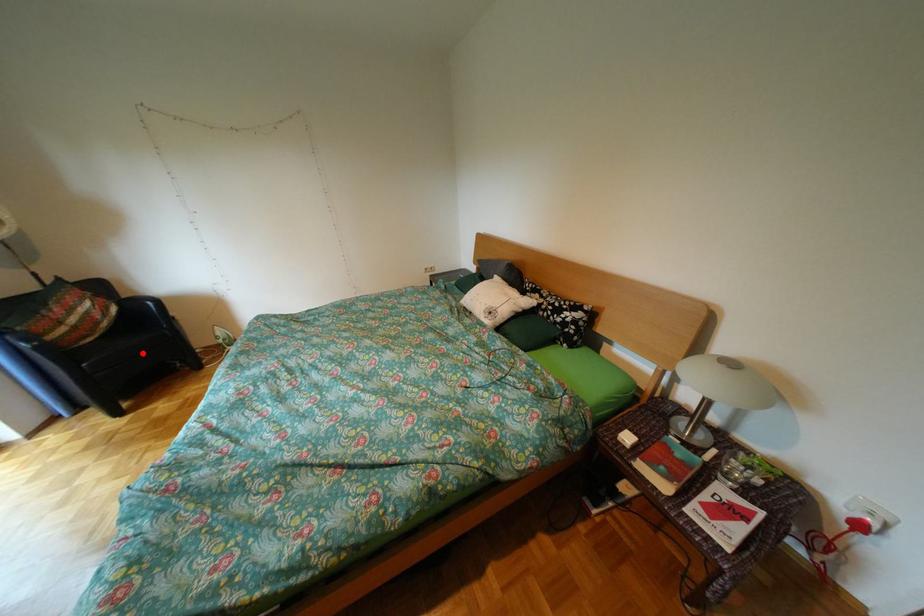
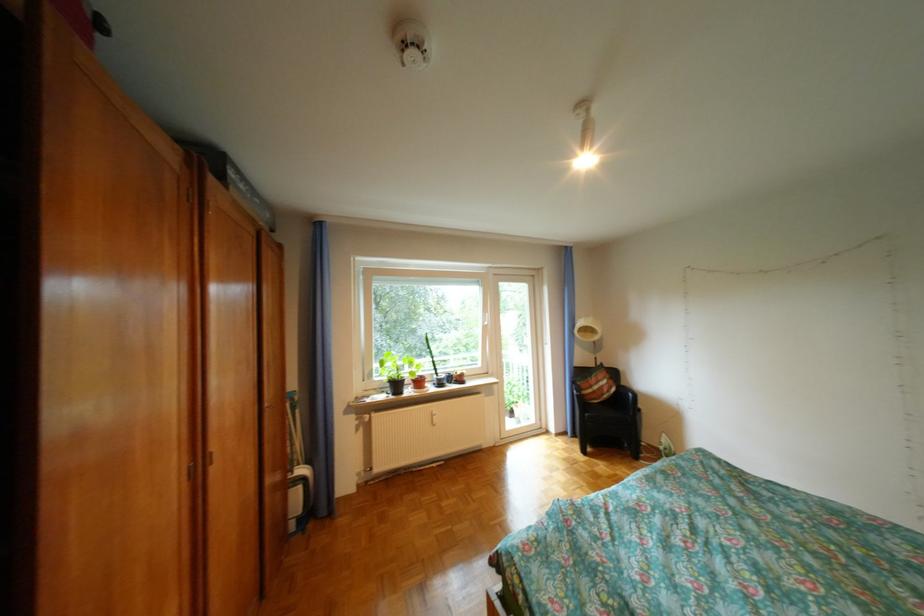
Question: I am providing you with two images of the same scene from different viewpoints. Image1 has a red point marked. In image2, the corresponding 3D location appears at what relative position? Reply with the corresponding letter.

Choices:
 (A) Closer
 (B) Farther

Answer: (B)